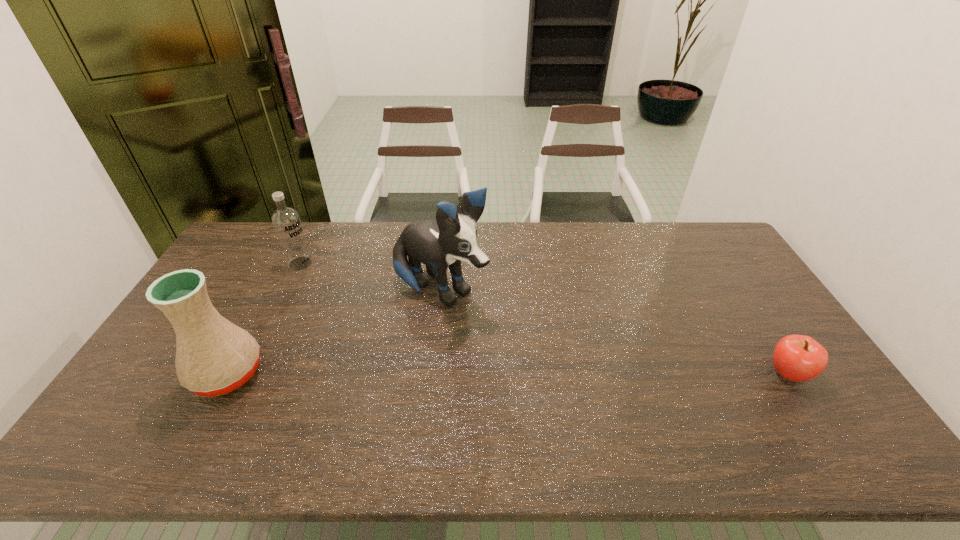
The image size is (960, 540). Identify the location of free space on the desktop that is between the pottery and the rightmost object and is positioned on the front-facing side of the puppy. (562, 374).

Locate an element on the screen. free space on the desktop that is between the pottery and the rightmost object and is positioned on the front label of the vodka is located at coordinates (451, 374).